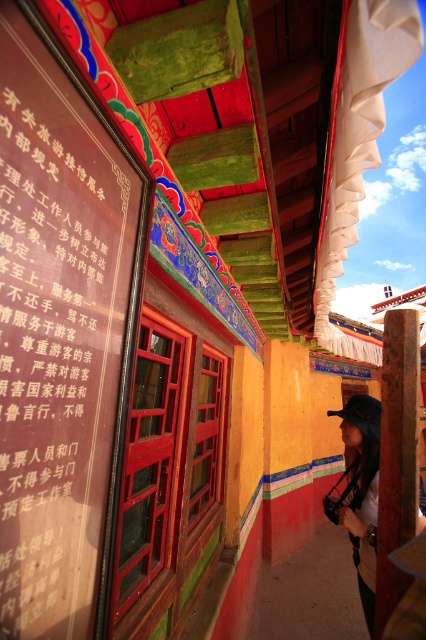
You are a tourist visiting this Tibetan cultural site and want to read the information on the matte black signboard at upper left. However, there is a matte black hat at lower right blocking your view. Based on the description, can you determine if the signboard is to the left or right of the hat?

The matte black signboard at upper left is positioned on the left side of the matte black hat at lower right, meaning the signboard is to the left of the hat.

Based on the photo, you are a visitor at this Tibetan building and need to place a small decoration on the shorter object between the brown wooden post at center and the matte black hat at lower right. Which object should you choose?

The brown wooden post at center has a lesser height compared to matte black hat at lower right, so you should place the small decoration on the brown wooden post at center.

You are a tour guide leading a group through this Tibetan cultural site. You need to ensure that your group can walk comfortably between the matte black signboard at upper left and the brown wooden post at center. The average shoulder width of a person in your group is 50 cm. Is there enough space for them to pass through this area comfortably?

The distance between the matte black signboard at upper left and the brown wooden post at center is 1.20 meters, which is 120 cm. Since the average shoulder width of a person is 50 cm, there is sufficient space for them to pass through comfortably.